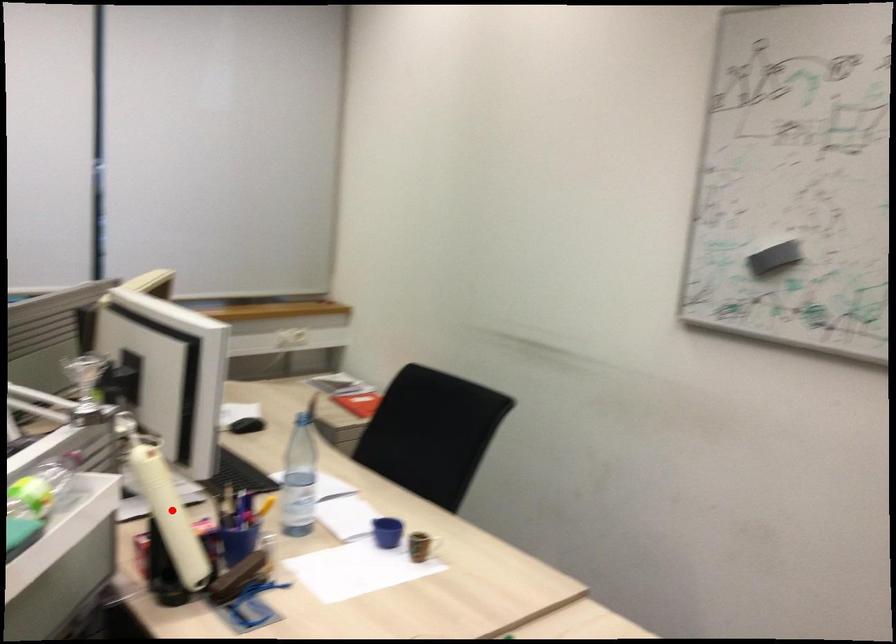
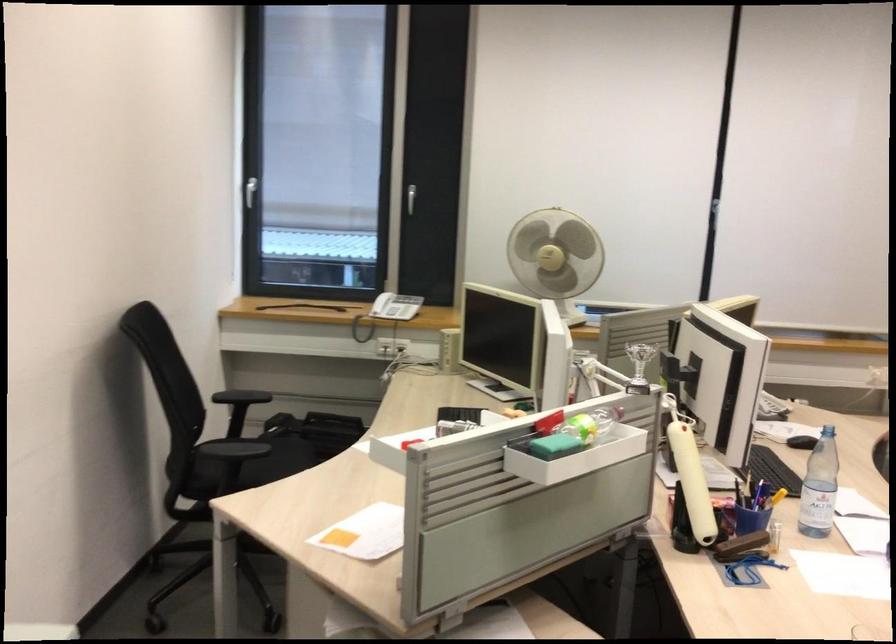
Locate, in the second image, the point that corresponds to the highlighted location in the first image.

(690, 475)